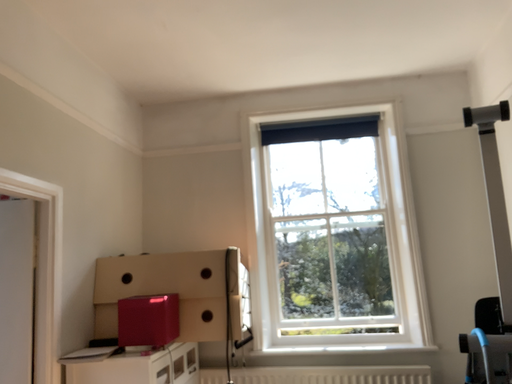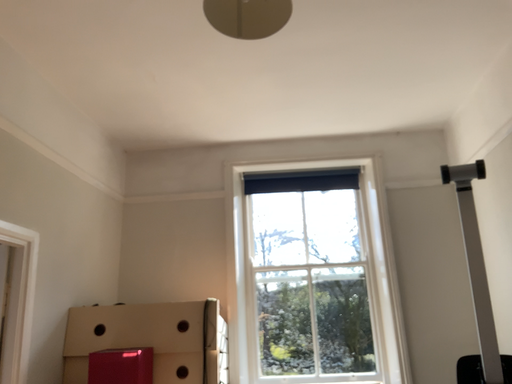
Question: Which way did the camera rotate in the video?

Choices:
 (A) rotated downward
 (B) rotated upward

Answer: (B)